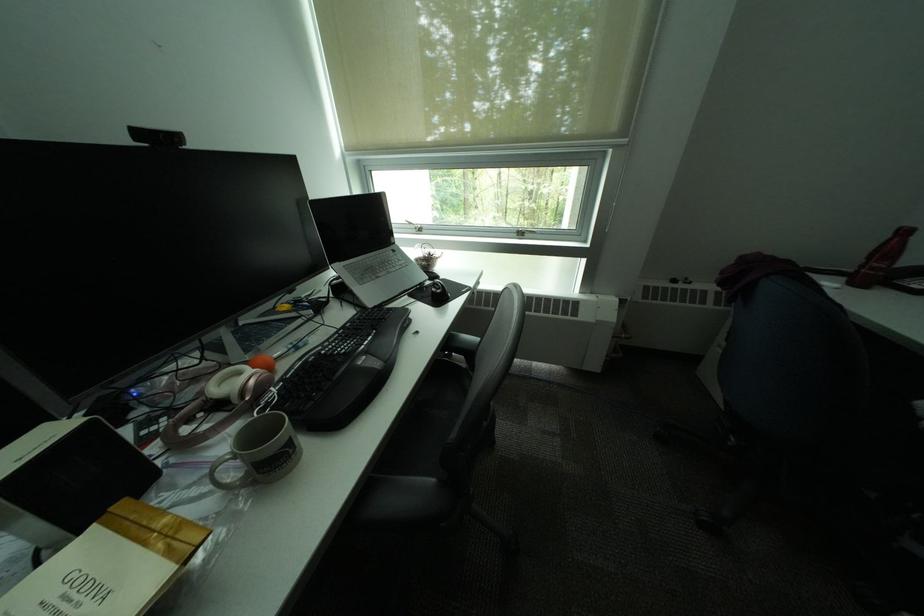
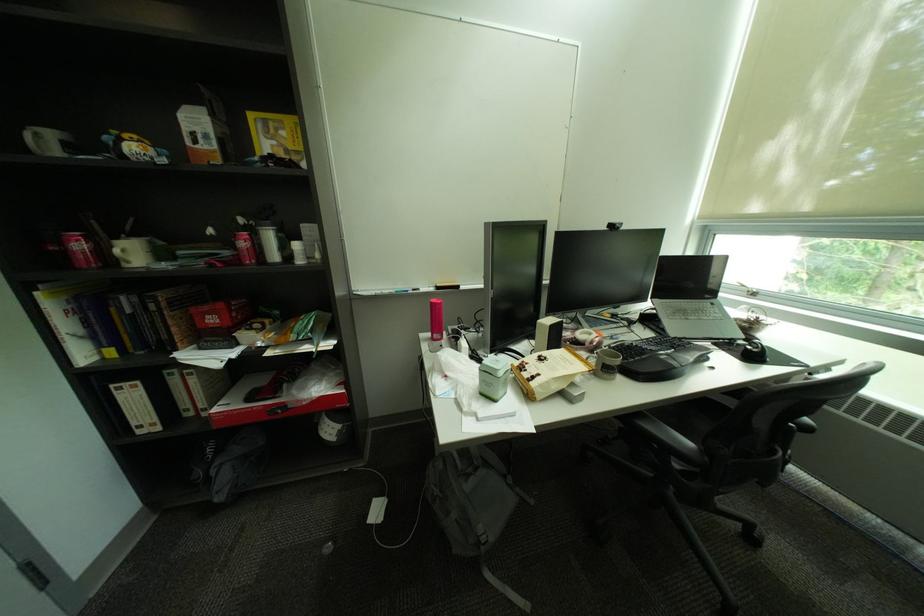
Where in the second image is the point corresponding to (x=450, y=293) from the first image?

(766, 352)